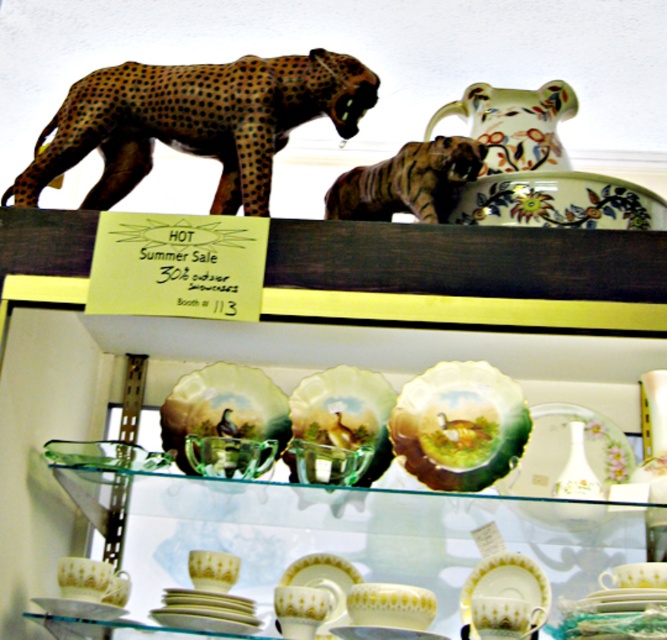
You are a customer in the shop and want to pick up the striped ceramic tiger at upper center and the floral ceramic pitcher at upper right. Which one do you need to reach further to grab?

You need to reach further to grab the floral ceramic pitcher at upper right because the striped ceramic tiger at upper center is closer to the viewer.

You are a customer looking at the display shelf and want to place a small decorative item between the green glazed plate at center and the porcelain plate at lower center. Based on their positions, where should you place it to ensure it is centered between them?

The green glazed plate at center is to the right of the porcelain plate at lower center, so placing the item halfway between them would mean positioning it to the left of the green glazed plate at center and to the right of the porcelain plate at lower center.